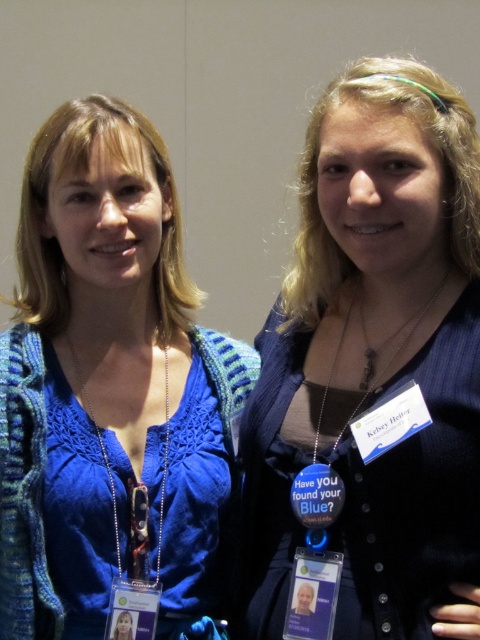
Where is `blue fabric shirt at center`? Image resolution: width=480 pixels, height=640 pixels. blue fabric shirt at center is located at coordinates (372, 369).

Does blue fabric shirt at center come in front of silver metallic chain at center?

Yes, blue fabric shirt at center is closer to the viewer.

The width and height of the screenshot is (480, 640). Find the location of `blue fabric shirt at center`. blue fabric shirt at center is located at coordinates (372, 369).

Does matte blue sweater at center have a lesser height compared to silver metallic chain at center?

In fact, matte blue sweater at center may be taller than silver metallic chain at center.

Is matte blue sweater at center to the left of silver metallic chain at center from the viewer's perspective?

Indeed, matte blue sweater at center is positioned on the left side of silver metallic chain at center.

Between point (213, 461) and point (166, 448), which one is positioned behind?

The point (213, 461) is more distant.

Locate an element on the screen. matte blue sweater at center is located at coordinates (108, 387).

Between point (371, 328) and point (155, 234), which one is positioned in front?

Point (371, 328) is more forward.

Does blue fabric shirt at center appear on the right side of matte blue sweater at center?

Indeed, blue fabric shirt at center is positioned on the right side of matte blue sweater at center.

Who is more distant from viewer, (304, 339) or (75, 525)?

The point (304, 339) is more distant.

What are the coordinates of `blue fabric shirt at center` in the screenshot? It's located at (372, 369).